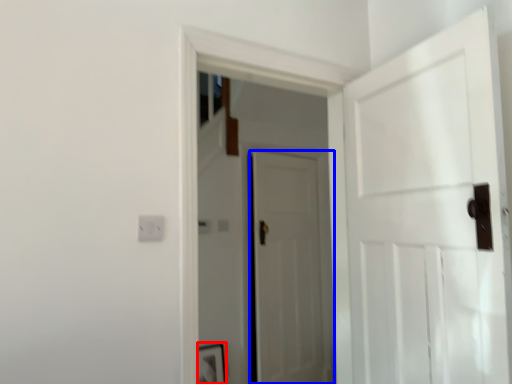
Question: Which object appears closest to the camera in this image, picture frame (highlighted by a red box) or door (highlighted by a blue box)?

Choices:
 (A) picture frame
 (B) door

Answer: (A)